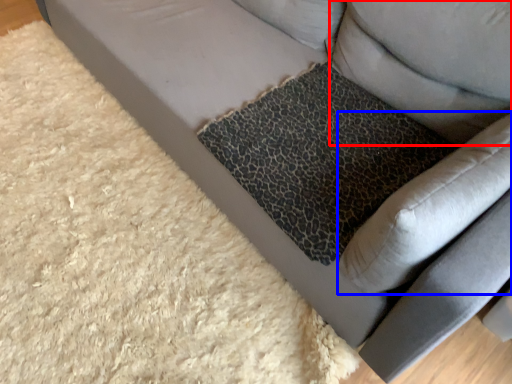
Question: Which point is further to the camera, pillow (highlighted by a red box) or swivel chair (highlighted by a blue box)?

Choices:
 (A) pillow
 (B) swivel chair

Answer: (A)